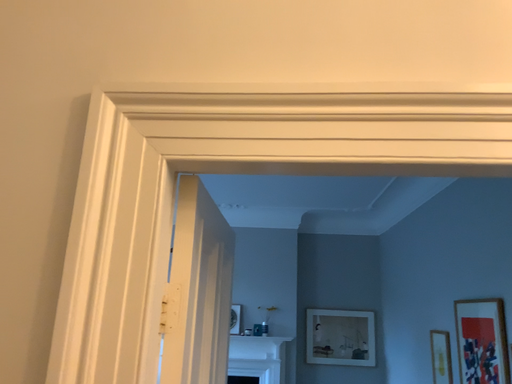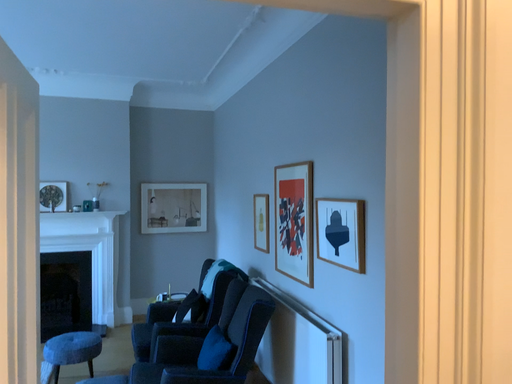
Question: How did the camera likely rotate when shooting the video?

Choices:
 (A) rotated right
 (B) rotated left

Answer: (A)